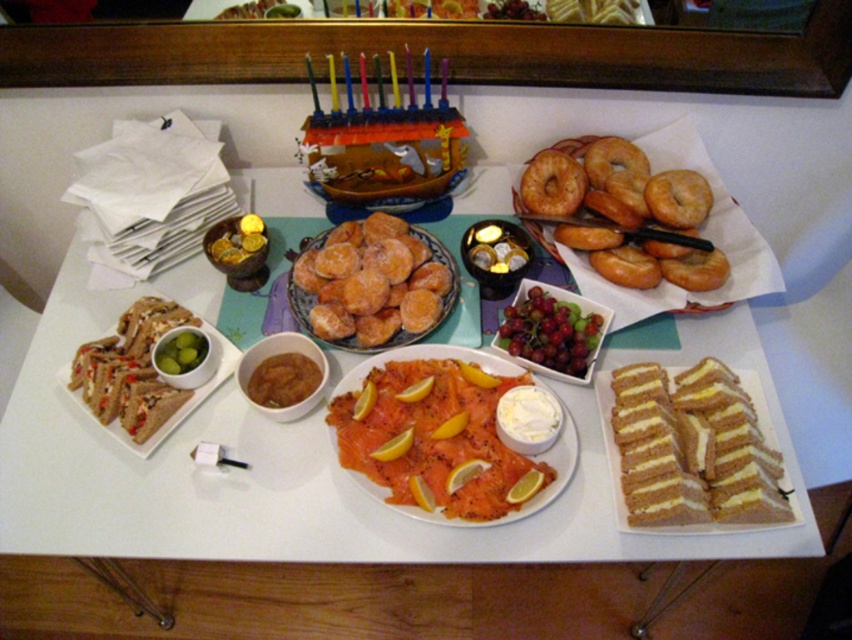
Does matte brown bagels at upper right have a larger size compared to golden glazed bagels at center?

Indeed, matte brown bagels at upper right has a larger size compared to golden glazed bagels at center.

Between matte brown bagels at upper right and golden glazed bagels at center, which one appears on the left side from the viewer's perspective?

matte brown bagels at upper right is more to the left.

Identify the location of matte brown bagels at upper right. The image size is (852, 640). 314,513.

Identify the location of matte brown bagels at upper right. This screenshot has height=640, width=852. 314,513.

Who is more distant from viewer, [561,208] or [78,380]?

Positioned behind is point [561,208].

Between golden glazed bagels at center and white bread sandwich at left, which one is positioned lower?

white bread sandwich at left is below.

This screenshot has height=640, width=852. What do you see at coordinates (622, 211) in the screenshot? I see `golden glazed bagels at center` at bounding box center [622, 211].

Where is `golden glazed bagels at center`? The image size is (852, 640). golden glazed bagels at center is located at coordinates (622, 211).

Does white bread sandwich at left have a smaller size compared to glazed doughnut at upper right?

Incorrect, white bread sandwich at left is not smaller in size than glazed doughnut at upper right.

Is point (85, 388) positioned before point (562, 179)?

That is True.

Between point (159, 420) and point (527, 202), which one is positioned in front?

Point (159, 420)

Locate an element on the screen. The height and width of the screenshot is (640, 852). white bread sandwich at left is located at coordinates (140, 376).